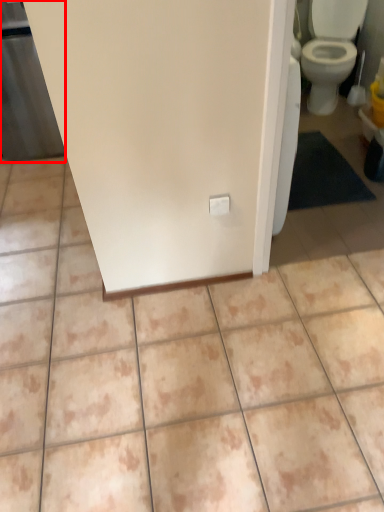
Question: Where is screen door (annotated by the red box) located in relation to ceramic tile in the image?

Choices:
 (A) right
 (B) left

Answer: (B)